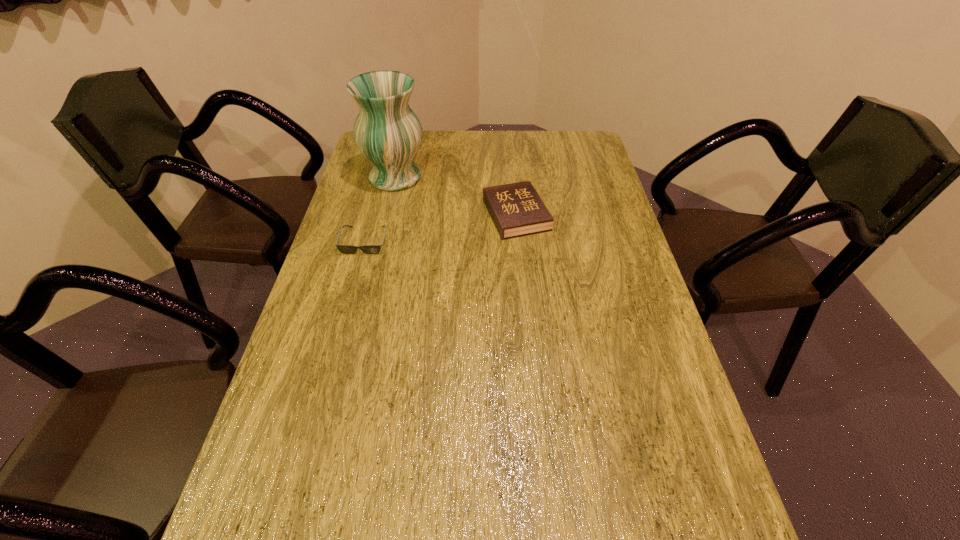
At what (x,y) coordinates should I click in order to perform the action: click on vase. Please return your answer as a coordinate pair (x, y). The image size is (960, 540). Looking at the image, I should click on (388, 133).

Identify the location of the second tallest object. (516, 209).

Locate an element on the screen. Image resolution: width=960 pixels, height=540 pixels. hardback book is located at coordinates (516, 209).

Locate an element on the screen. The image size is (960, 540). the shortest object is located at coordinates (345, 249).

What are the coordinates of `vacant position located 0.130m on the right of the tallest object` in the screenshot? It's located at click(x=465, y=177).

I want to click on vacant space positioned on the back of the rightmost object, so click(509, 134).

Image resolution: width=960 pixels, height=540 pixels. Find the location of `vacant region located on the front-facing side of the sunglasses`. vacant region located on the front-facing side of the sunglasses is located at coordinates (347, 306).

This screenshot has width=960, height=540. I want to click on object that is at the far edge, so click(x=388, y=133).

At what (x,y) coordinates should I click in order to perform the action: click on vase that is at the left edge. Please return your answer as a coordinate pair (x, y). The height and width of the screenshot is (540, 960). Looking at the image, I should click on (388, 133).

Identify the location of sunglasses present at the left edge. (345, 249).